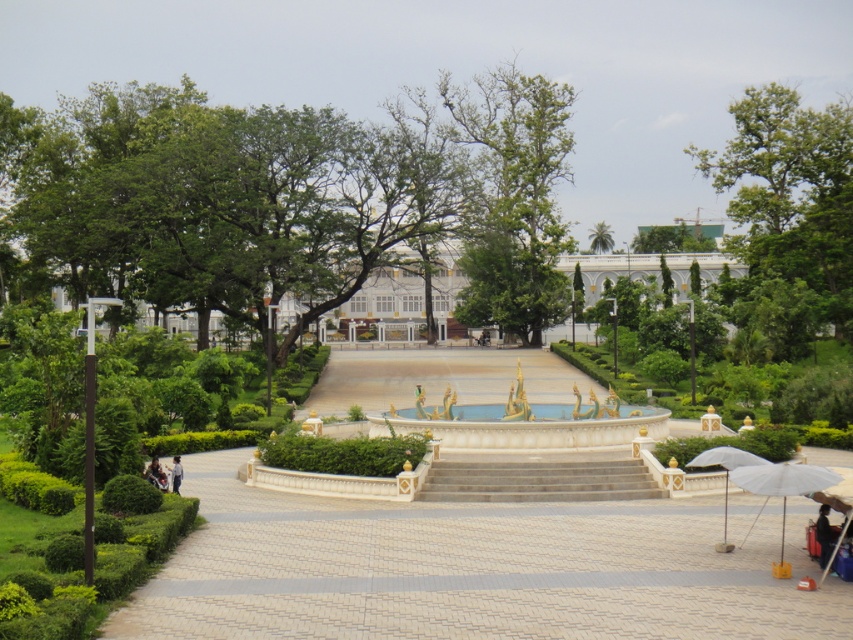
Question: Which object is the farthest from the gold metallic fountain at center?

Choices:
 (A) green leafy tree at upper right
 (B) white fabric umbrella at lower right

Answer: (A)

Question: Can you confirm if green leafy tree at center is positioned above smooth stone stairs at center?

Choices:
 (A) no
 (B) yes

Answer: (B)

Question: Which object appears closest to the camera in this image?

Choices:
 (A) green leafy tree at upper right
 (B) dark blue jeans at lower left
 (C) smooth stone stairs at center
 (D) green leafy tree at center

Answer: (B)

Question: Which point is closer to the camera taking this photo?

Choices:
 (A) (833, 481)
 (B) (698, 464)
 (C) (840, 259)

Answer: (A)

Question: Is white stone pathway at center behind black fabric umbrella at lower right?

Choices:
 (A) yes
 (B) no

Answer: (B)

Question: Does green leafy tree at upper right appear over smooth stone stairs at center?

Choices:
 (A) yes
 (B) no

Answer: (A)